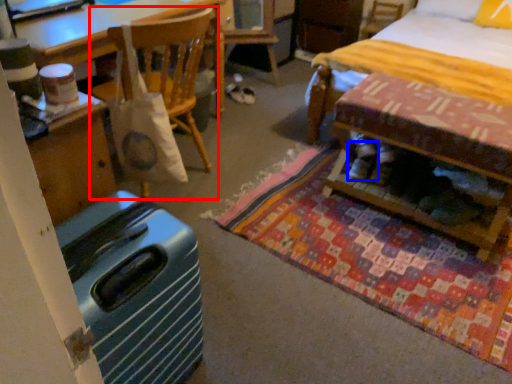
Question: Which point is closer to the camera, chair (highlighted by a red box) or footwear (highlighted by a blue box)?

Choices:
 (A) chair
 (B) footwear

Answer: (A)